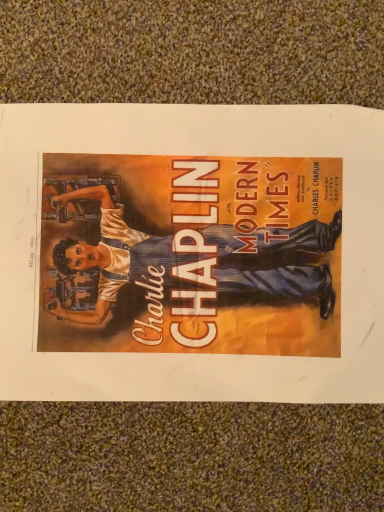
Describe the element at coordinates (193, 253) in the screenshot. The image size is (384, 512). I see `matte blue overalls at center` at that location.

At what (x,y) coordinates should I click in order to perform the action: click on matte blue overalls at center. Please return your answer as a coordinate pair (x, y). The height and width of the screenshot is (512, 384). Looking at the image, I should click on (193, 253).

Where is `matte blue overalls at center`? This screenshot has height=512, width=384. matte blue overalls at center is located at coordinates (193, 253).